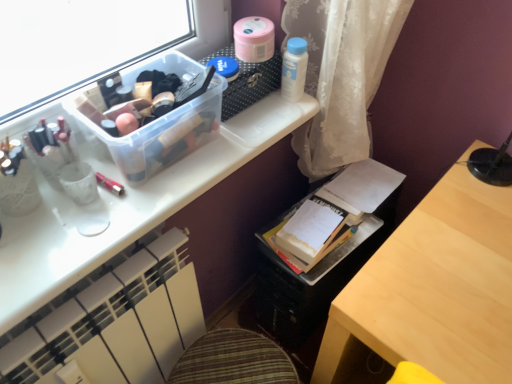
Question: Is matte white desk at upper center oriented towards white paper book at center?

Choices:
 (A) no
 (B) yes

Answer: (A)

Question: From a real-world perspective, does matte white desk at upper center stand above white paper book at center?

Choices:
 (A) no
 (B) yes

Answer: (B)

Question: Is matte white desk at upper center bigger than white paper book at center?

Choices:
 (A) no
 (B) yes

Answer: (B)

Question: Is matte white desk at upper center shorter than white paper book at center?

Choices:
 (A) no
 (B) yes

Answer: (A)

Question: Is matte white desk at upper center touching white paper book at center?

Choices:
 (A) no
 (B) yes

Answer: (A)

Question: From the image's perspective, is matte white desk at upper center located above white paper book at center?

Choices:
 (A) no
 (B) yes

Answer: (B)

Question: From a real-world perspective, is white paper book at center positioned under matte white desk at upper center based on gravity?

Choices:
 (A) yes
 (B) no

Answer: (A)

Question: Can you confirm if white paper book at center is bigger than matte white desk at upper center?

Choices:
 (A) yes
 (B) no

Answer: (B)

Question: Is white paper book at center to the right of matte white desk at upper center from the viewer's perspective?

Choices:
 (A) no
 (B) yes

Answer: (B)

Question: From the image's perspective, is white paper book at center located beneath matte white desk at upper center?

Choices:
 (A) no
 (B) yes

Answer: (B)

Question: Does white paper book at center have a greater height compared to matte white desk at upper center?

Choices:
 (A) no
 (B) yes

Answer: (A)

Question: Is white paper book at center further to camera compared to matte white desk at upper center?

Choices:
 (A) yes
 (B) no

Answer: (A)

Question: Can you confirm if white plastic bottle at upper right, which is counted as the first toiletry, starting from the right, is shorter than metallic pink pen at upper left, the first toiletry positioned from the bottom?

Choices:
 (A) yes
 (B) no

Answer: (B)